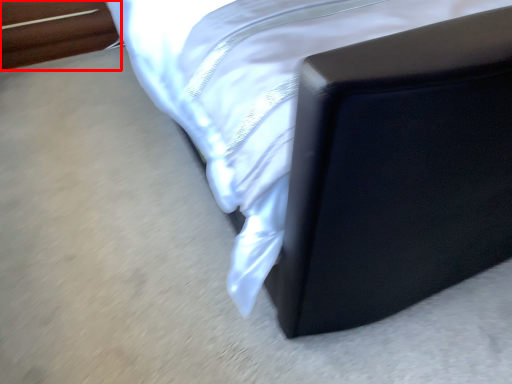
Question: From the image's perspective, where is furniture (annotated by the red box) located in relation to furniture in the image?

Choices:
 (A) below
 (B) above

Answer: (A)